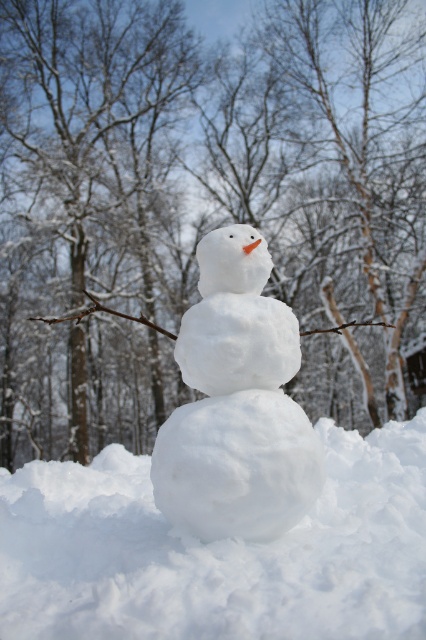
Question: Which object is closer to the camera taking this photo?

Choices:
 (A) white snow at center
 (B) white fluffy snowman at center
 (C) white fluffy snowball at center

Answer: (C)

Question: Which object is the closest to the white fluffy snowball at center?

Choices:
 (A) white snow at center
 (B) white fluffy snowman at center

Answer: (B)

Question: Does white snow at center have a greater width compared to white fluffy snowball at center?

Choices:
 (A) yes
 (B) no

Answer: (A)

Question: Can you confirm if white fluffy snowball at center is wider than white fluffy snowman at center?

Choices:
 (A) yes
 (B) no

Answer: (A)

Question: Can you confirm if white snow at center is positioned below white fluffy snowball at center?

Choices:
 (A) yes
 (B) no

Answer: (B)

Question: Which object is farther from the camera taking this photo?

Choices:
 (A) white fluffy snowman at center
 (B) white fluffy snowball at center
 (C) white snow at center

Answer: (C)